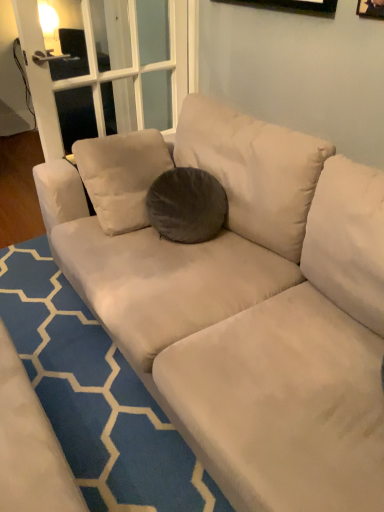
At what (x,y) coordinates should I click in order to perform the action: click on dark gray velvety pillow at center. Please return your answer as a coordinate pair (x, y). Image resolution: width=384 pixels, height=512 pixels. Looking at the image, I should click on (187, 205).

Describe the element at coordinates (371, 9) in the screenshot. I see `wooden frame at upper right` at that location.

Where is `blue textured rug at center`? This screenshot has width=384, height=512. blue textured rug at center is located at coordinates (96, 396).

You are a GUI agent. You are given a task and a screenshot of the screen. Output one action in this format:
    pyautogui.click(x=<x>, y=<y>)
    Task: Click on the dark gray velvety pillow at center
    This screenshot has height=512, width=384.
    Given the screenshot: What is the action you would take?
    coord(187,205)

From a real-world perspective, which object stands above the other?

wooden frame at upper right is physically above.

Between wooden frame at upper right and dark gray velvety pillow at center, which one is positioned behind?

dark gray velvety pillow at center.

From the image's perspective, would you say wooden frame at upper right is shown under dark gray velvety pillow at center?

No, from the image's perspective, wooden frame at upper right is not beneath dark gray velvety pillow at center.

How far apart are wooden frame at upper right and dark gray velvety pillow at center?

34.90 inches.

In the scene shown: Is dark gray velvety pillow at center outside of wooden frame at upper right?

Indeed, dark gray velvety pillow at center is completely outside wooden frame at upper right.

Relative to wooden frame at upper right, is dark gray velvety pillow at center in front or behind?

dark gray velvety pillow at center is positioned farther from the viewer than wooden frame at upper right.

Is dark gray velvety pillow at center with wooden frame at upper right?

No, dark gray velvety pillow at center is not with wooden frame at upper right.

Considering the sizes of objects dark gray velvety pillow at center and wooden frame at upper right in the image provided, who is taller, dark gray velvety pillow at center or wooden frame at upper right?

With more height is dark gray velvety pillow at center.

Is blue textured rug at center not within dark gray velvety pillow at center?

Yes, blue textured rug at center is located beyond the bounds of dark gray velvety pillow at center.

Where is `doormat on the left side of dark gray velvety pillow at center`? This screenshot has height=512, width=384. doormat on the left side of dark gray velvety pillow at center is located at coordinates (96, 396).

Is blue textured rug at center closer to the viewer compared to dark gray velvety pillow at center?

Yes, it is in front of dark gray velvety pillow at center.

Which is closer to the camera, (168, 470) or (217, 215)?

Clearly, point (168, 470) is closer to the camera than point (217, 215).

Considering the relative sizes of wooden frame at upper right and blue textured rug at center in the image provided, is wooden frame at upper right wider than blue textured rug at center?

No, wooden frame at upper right is not wider than blue textured rug at center.

From a real-world perspective, does wooden frame at upper right sit lower than blue textured rug at center?

No.

Is wooden frame at upper right positioned beyond the bounds of blue textured rug at center?

Yes.

Is wooden frame at upper right next to blue textured rug at center?

There is a gap between wooden frame at upper right and blue textured rug at center.

Is dark gray velvety pillow at center oriented away from blue textured rug at center?

dark gray velvety pillow at center does not have its back to blue textured rug at center.

Based on their sizes in the image, would you say dark gray velvety pillow at center is bigger or smaller than blue textured rug at center?

Clearly, dark gray velvety pillow at center is smaller in size than blue textured rug at center.

Between dark gray velvety pillow at center and blue textured rug at center, which one has more height?

dark gray velvety pillow at center.

Is blue textured rug at center next to wooden frame at upper right and touching it?

blue textured rug at center is not next to wooden frame at upper right, and they're not touching.

From the image's perspective, is blue textured rug at center beneath wooden frame at upper right?

Correct, blue textured rug at center appears lower than wooden frame at upper right in the image.

Is blue textured rug at center bigger or smaller than wooden frame at upper right?

Clearly, blue textured rug at center is larger in size than wooden frame at upper right.

In terms of height, does blue textured rug at center look taller or shorter compared to wooden frame at upper right?

blue textured rug at center is shorter than wooden frame at upper right.

In order to click on throw pillow behind the wooden frame at upper right in this screenshot , I will do `click(187, 205)`.

Find the location of a particular element. The width and height of the screenshot is (384, 512). throw pillow below the wooden frame at upper right (from the image's perspective) is located at coordinates (187, 205).

When comparing their distances from dark gray velvety pillow at center, does wooden frame at upper right or blue textured rug at center seem closer?

blue textured rug at center is closer to dark gray velvety pillow at center.

When comparing their distances from wooden frame at upper right, does blue textured rug at center or dark gray velvety pillow at center seem further?

The object further to wooden frame at upper right is blue textured rug at center.

Considering their positions, is blue textured rug at center positioned closer to dark gray velvety pillow at center than wooden frame at upper right?

Among the two, blue textured rug at center is located nearer to dark gray velvety pillow at center.

Which object lies nearer to the anchor point blue textured rug at center, wooden frame at upper right or dark gray velvety pillow at center?

dark gray velvety pillow at center is positioned closer to the anchor blue textured rug at center.

From the image, which object appears to be farther from blue textured rug at center, dark gray velvety pillow at center or wooden frame at upper right?

The object further to blue textured rug at center is wooden frame at upper right.

Estimate the real-world distances between objects in this image. Which object is closer to wooden frame at upper right, dark gray velvety pillow at center or blue textured rug at center?

dark gray velvety pillow at center is closer to wooden frame at upper right.

Where is `throw pillow between wooden frame at upper right and blue textured rug at center in the up-down direction`? Image resolution: width=384 pixels, height=512 pixels. throw pillow between wooden frame at upper right and blue textured rug at center in the up-down direction is located at coordinates (187, 205).